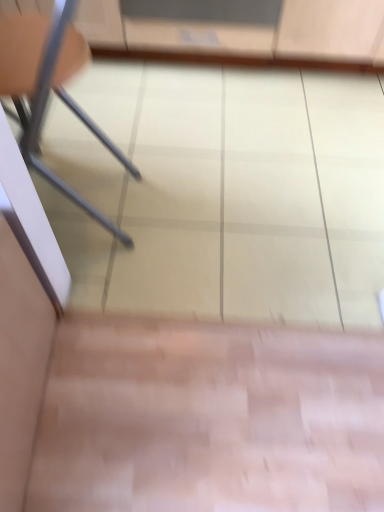
Question: Choose the correct answer: Is metallic gray chair at left inside transparent plastic screen door at upper center or outside it?

Choices:
 (A) outside
 (B) inside

Answer: (A)

Question: Is point (72, 190) closer or farther from the camera than point (241, 26)?

Choices:
 (A) farther
 (B) closer

Answer: (B)

Question: From their relative heights in the image, would you say metallic gray chair at left is taller or shorter than transparent plastic screen door at upper center?

Choices:
 (A) short
 (B) tall

Answer: (B)

Question: Considering the positions of transparent plastic screen door at upper center and metallic gray chair at left in the image, is transparent plastic screen door at upper center taller or shorter than metallic gray chair at left?

Choices:
 (A) tall
 (B) short

Answer: (B)

Question: Based on their positions, is transparent plastic screen door at upper center located to the left or right of metallic gray chair at left?

Choices:
 (A) right
 (B) left

Answer: (A)

Question: From the image's perspective, is transparent plastic screen door at upper center located above or below metallic gray chair at left?

Choices:
 (A) above
 (B) below

Answer: (A)

Question: Considering the positions of transparent plastic screen door at upper center and metallic gray chair at left in the image, is transparent plastic screen door at upper center bigger or smaller than metallic gray chair at left?

Choices:
 (A) big
 (B) small

Answer: (B)